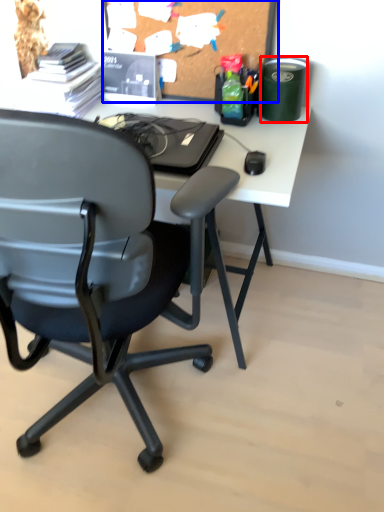
Question: Which point is closer to the camera, stationery (highlighted by a red box) or bulletin board (highlighted by a blue box)?

Choices:
 (A) stationery
 (B) bulletin board

Answer: (B)